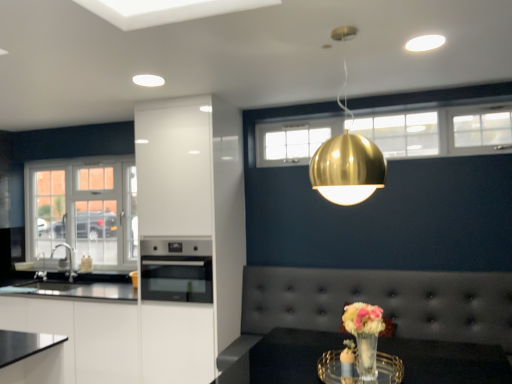
This screenshot has width=512, height=384. What are the coordinates of `white glossy cabinet at center` in the screenshot? It's located at (191, 228).

Image resolution: width=512 pixels, height=384 pixels. What are the coordinates of `white glass window at left` in the screenshot? It's located at (83, 210).

This screenshot has height=384, width=512. What do you see at coordinates (347, 169) in the screenshot?
I see `gold metallic sphere at upper center` at bounding box center [347, 169].

The image size is (512, 384). Find the location of `clear glass tray at lower center`. clear glass tray at lower center is located at coordinates (448, 361).

Describe the element at coordinates (448, 361) in the screenshot. I see `clear glass tray at lower center` at that location.

The image size is (512, 384). What do you see at coordinates (121, 337) in the screenshot?
I see `white glossy cabinet at lower left` at bounding box center [121, 337].

Find the location of `translucent glass vase at lower center`. translucent glass vase at lower center is located at coordinates (364, 335).

Identify the location of stainless steel oven at center. (176, 270).

From their relative heights in the image, would you say clear glass tray at lower center is taller or shorter than translucent glass vase at lower center?

Clearly, clear glass tray at lower center is taller compared to translucent glass vase at lower center.

Are clear glass tray at lower center and translucent glass vase at lower center beside each other?

They are not placed beside each other.

From a real-world perspective, is clear glass tray at lower center located higher than translucent glass vase at lower center?

No, from a real-world perspective, clear glass tray at lower center is not above translucent glass vase at lower center.

Consider the image. Looking at the image, does clear glass tray at lower center seem bigger or smaller compared to translucent glass vase at lower center?

Clearly, clear glass tray at lower center is larger in size than translucent glass vase at lower center.

Considering the relative positions of clear glass tray at lower center and gold metallic sphere at upper center in the image provided, is clear glass tray at lower center to the left of gold metallic sphere at upper center from the viewer's perspective?

Incorrect, clear glass tray at lower center is not on the left side of gold metallic sphere at upper center.

Is clear glass tray at lower center not near gold metallic sphere at upper center?

That's right, there is a large distance between clear glass tray at lower center and gold metallic sphere at upper center.

From the picture: From the image's perspective, which one is positioned lower, clear glass tray at lower center or gold metallic sphere at upper center?

From the image's view, clear glass tray at lower center is below.

In the image, is white glossy cabinet at center positioned in front of or behind gold metallic sphere at upper center?

In the image, white glossy cabinet at center appears behind gold metallic sphere at upper center.

Is white glossy cabinet at center at the right side of gold metallic sphere at upper center?

Incorrect, white glossy cabinet at center is not on the right side of gold metallic sphere at upper center.

From the image's perspective, which one is positioned higher, white glossy cabinet at center or gold metallic sphere at upper center?

gold metallic sphere at upper center.

From the picture: Does white glossy cabinet at center turn towards gold metallic sphere at upper center?

No, white glossy cabinet at center is not aimed at gold metallic sphere at upper center.

Is stainless steel oven at center far from gold metallic sphere at upper center?

Indeed, stainless steel oven at center is not near gold metallic sphere at upper center.

From the image's perspective, who appears lower, stainless steel oven at center or gold metallic sphere at upper center?

stainless steel oven at center appears lower in the image.

Based on the photo, how much distance is there between stainless steel oven at center and gold metallic sphere at upper center?

They are 1.43 meters apart.

Is stainless steel oven at center oriented away from gold metallic sphere at upper center?

stainless steel oven at center does not have its back to gold metallic sphere at upper center.

In order to click on window positioned vertically above the white glossy cabinet at lower left (from a real-world perspective) in this screenshot , I will do `click(83, 210)`.

Can you tell me how much white glass window at left and white glossy cabinet at lower left differ in facing direction?

0.596 degrees.

From the image's perspective, which is above, white glass window at left or white glossy cabinet at lower left?

white glass window at left is shown above in the image.

Who is more distant, white glass window at left or white glossy cabinet at lower left?

white glass window at left.

Would you say gold metallic sphere at upper center is a long distance from tufted leather couch at center?

gold metallic sphere at upper center is positioned a significant distance from tufted leather couch at center.

Would you say gold metallic sphere at upper center is to the left or to the right of tufted leather couch at center in the picture?

Based on their positions, gold metallic sphere at upper center is located to the left of tufted leather couch at center.

Is gold metallic sphere at upper center turned away from tufted leather couch at center?

gold metallic sphere at upper center does not have its back to tufted leather couch at center.

From the picture: In terms of width, does gold metallic sphere at upper center look wider or thinner when compared to tufted leather couch at center?

In the image, gold metallic sphere at upper center appears to be more narrow than tufted leather couch at center.

Between white glossy cabinet at center and white glass window at left, which one appears on the right side from the viewer's perspective?

Positioned to the right is white glossy cabinet at center.

Can you confirm if white glossy cabinet at center is smaller than white glass window at left?

Incorrect, white glossy cabinet at center is not smaller in size than white glass window at left.

Can white glass window at left be found inside white glossy cabinet at center?

Definitely not — white glass window at left is not inside white glossy cabinet at center.

Is point (175, 188) positioned before point (30, 182)?

Yes, it is in front of point (30, 182).

The width and height of the screenshot is (512, 384). Identify the location of table in front of the translucent glass vase at lower center. (448, 361).

I want to click on lamp behind the clear glass tray at lower center, so click(347, 169).

Considering their positions, is clear glass tray at lower center positioned closer to gold metallic sphere at upper center than stainless steel oven at center?

Among the two, clear glass tray at lower center is located nearer to gold metallic sphere at upper center.

Estimate the real-world distances between objects in this image. Which object is closer to tufted leather couch at center, gold metallic sphere at upper center or white glass window at left?

gold metallic sphere at upper center is closer to tufted leather couch at center.

From the picture: Looking at the image, which one is located further to white glass window at left, clear glass tray at lower center or gold metallic sphere at upper center?

clear glass tray at lower center.

When comparing their distances from white glass window at left, does stainless steel oven at center or gold metallic sphere at upper center seem further?

gold metallic sphere at upper center lies further to white glass window at left than the other object.

From the image, which object appears to be farther from white glossy cabinet at lower left, white glass window at left or clear glass tray at lower center?

Among the two, clear glass tray at lower center is located further to white glossy cabinet at lower left.

Looking at the image, which one is located further to translucent glass vase at lower center, white glass window at left or white glossy cabinet at center?

The object further to translucent glass vase at lower center is white glass window at left.

Estimate the real-world distances between objects in this image. Which object is further from translucent glass vase at lower center, gold metallic sphere at upper center or white glass window at left?

The object further to translucent glass vase at lower center is white glass window at left.

Based on their spatial positions, is white glass window at left or white glossy cabinet at lower left closer to translucent glass vase at lower center?

Among the two, white glossy cabinet at lower left is located nearer to translucent glass vase at lower center.

Locate an element on the screen. oven positioned between gold metallic sphere at upper center and white glossy cabinet at center from near to far is located at coordinates (176, 270).

Image resolution: width=512 pixels, height=384 pixels. Identify the location of side between gold metallic sphere at upper center and white glass window at left in the front-back direction. (191, 228).

The height and width of the screenshot is (384, 512). In order to click on oven between white glossy cabinet at lower left and translucent glass vase at lower center from left to right in this screenshot , I will do `click(176, 270)`.

This screenshot has height=384, width=512. In order to click on floral arrangement between gold metallic sphere at upper center and white glass window at left in the front-back direction in this screenshot , I will do `click(364, 335)`.